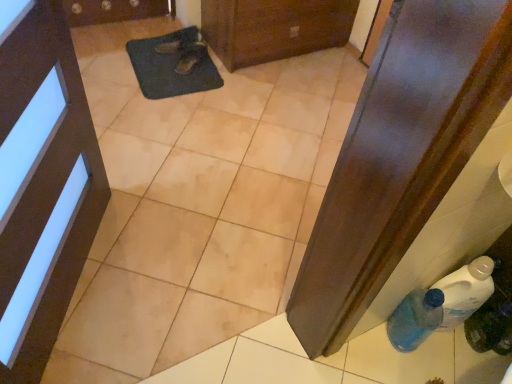
I want to click on free space between brown leather shoe at center, acting as the first footwear starting from the bottom, and black leather shoe at upper center, positioned as the second footwear in bottom-to-top order, so click(x=169, y=61).